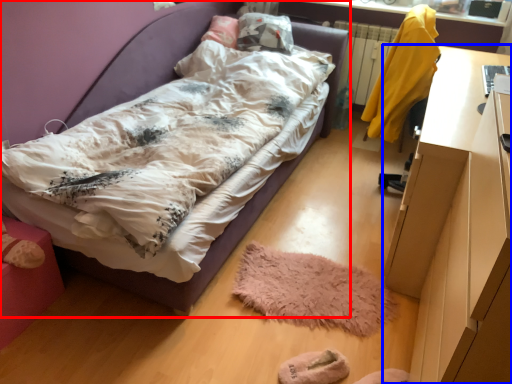
Question: Which object appears closest to the camera in this image, bed (highlighted by a red box) or desk (highlighted by a blue box)?

Choices:
 (A) bed
 (B) desk

Answer: (B)